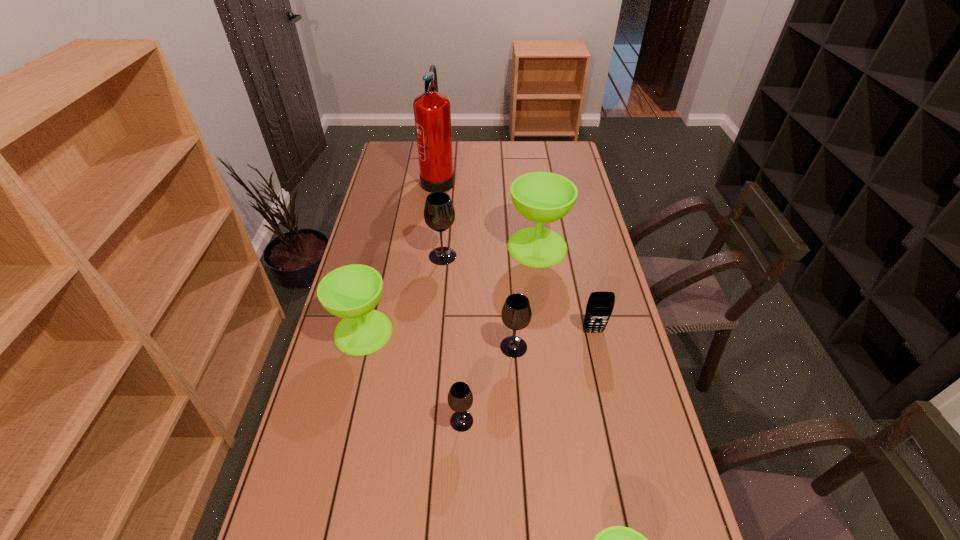
Locate an element on the screen. The image size is (960, 540). vacant space that satisfies the following two spatial constraints: 1. on the front side of the second farthest green wineglass; 2. on the left side of the second nearest gray wineglass is located at coordinates [x=360, y=347].